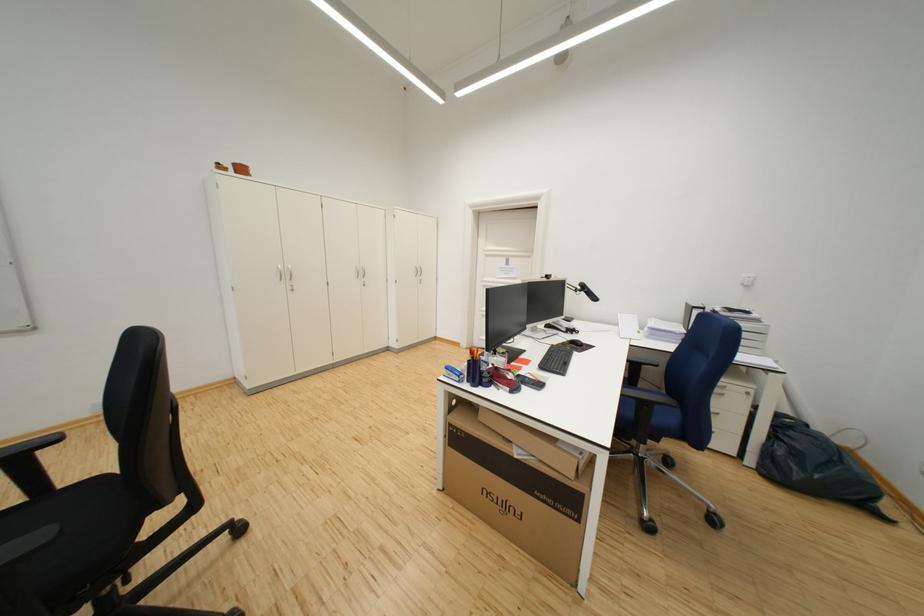
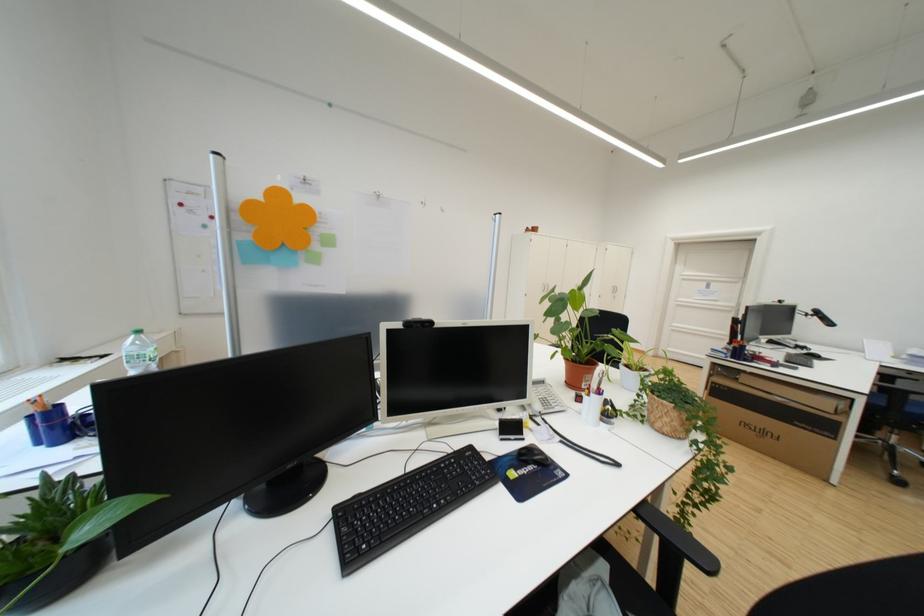
Where in the second image is the point corresponding to point 518,265 from the first image?

(720, 288)